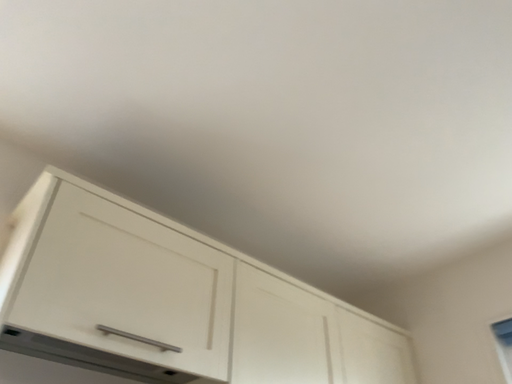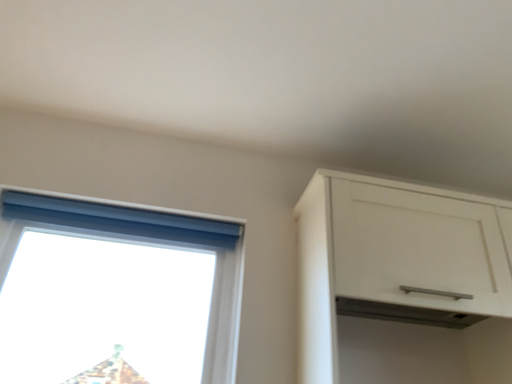
Question: Which way did the camera rotate in the video?

Choices:
 (A) rotated left
 (B) rotated right

Answer: (A)